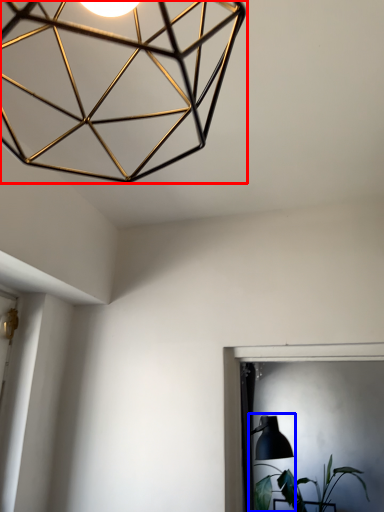
Question: Among these objects, which one is nearest to the camera, lamp (highlighted by a red box) or table lamp (highlighted by a blue box)?

Choices:
 (A) lamp
 (B) table lamp

Answer: (A)